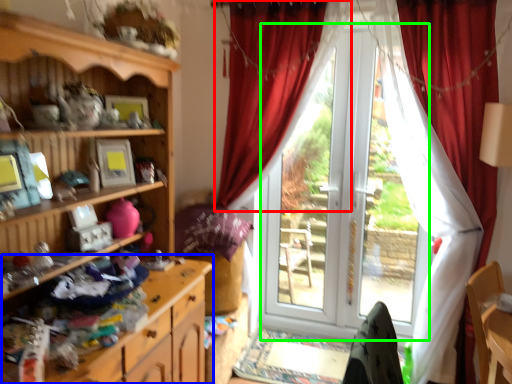
Question: Based on their relative distances, which object is nearer to curtain (highlighted by a red box)? Choose from cabinetry (highlighted by a blue box) and screen door (highlighted by a green box).

Choices:
 (A) cabinetry
 (B) screen door

Answer: (B)